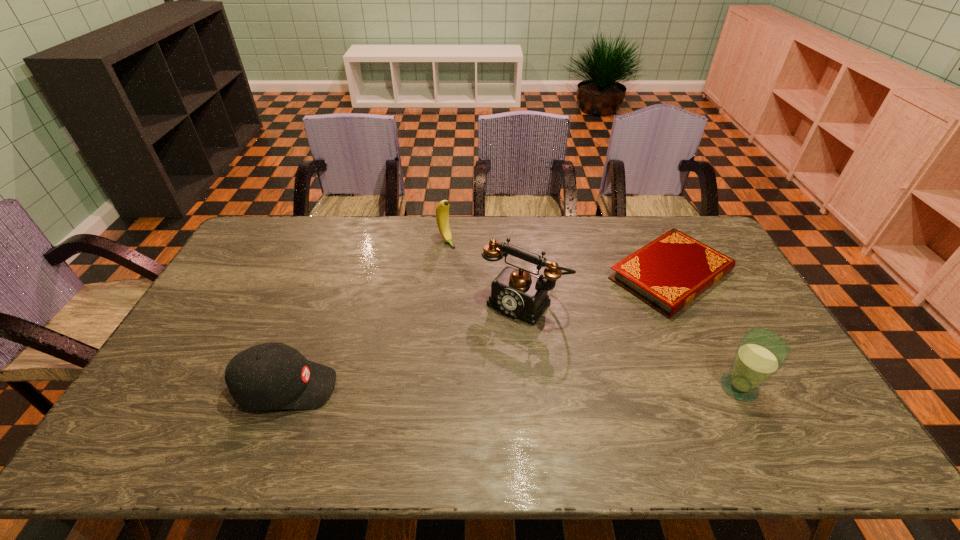
Image resolution: width=960 pixels, height=540 pixels. What are the coordinates of `baseball cap that is at the near edge` in the screenshot? It's located at (273, 375).

Locate an element on the screen. glass that is at the near edge is located at coordinates (761, 353).

This screenshot has height=540, width=960. Identify the location of glass located at the right edge. (761, 353).

The height and width of the screenshot is (540, 960). What are the coordinates of `hardback book positioned at the right edge` in the screenshot? It's located at (668, 273).

At what (x,y) coordinates should I click in order to perform the action: click on object present at the far right corner. Please return your answer as a coordinate pair (x, y). Image resolution: width=960 pixels, height=540 pixels. Looking at the image, I should click on point(668,273).

Identify the location of object located in the near right corner section of the desktop. The width and height of the screenshot is (960, 540). (761, 353).

Locate an element on the screen. vacant space at the far edge of the desktop is located at coordinates (304, 245).

Locate an element on the screen. vacant region at the near edge is located at coordinates (704, 393).

This screenshot has width=960, height=540. I want to click on vacant space at the left edge of the desktop, so click(237, 327).

Locate an element on the screen. empty space between the glass and the fourth tallest object is located at coordinates (513, 388).